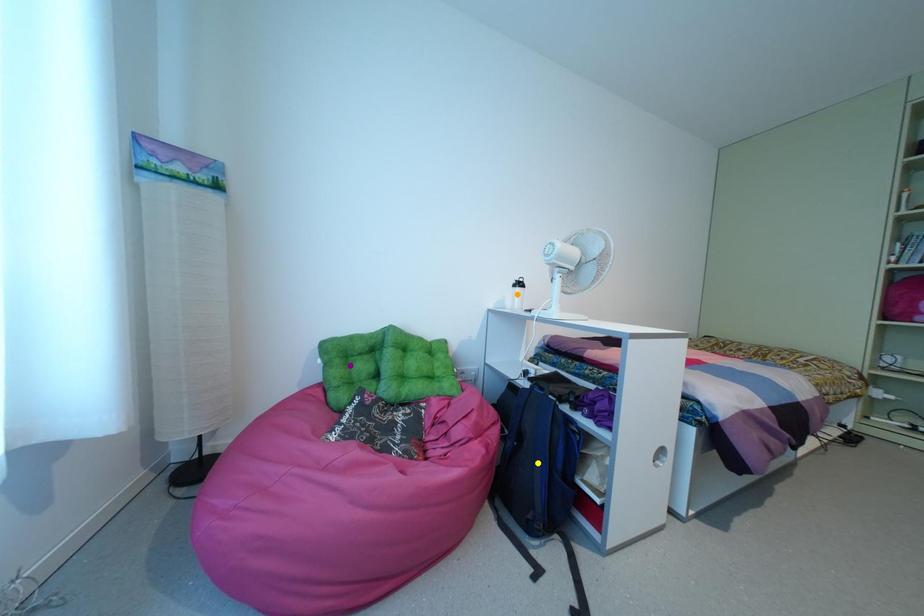
Order these from nearest to farthest:
purple point
orange point
yellow point

yellow point
purple point
orange point